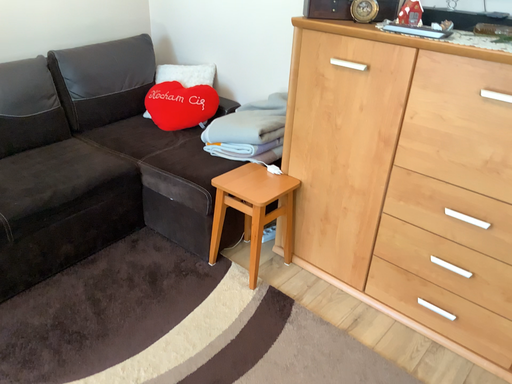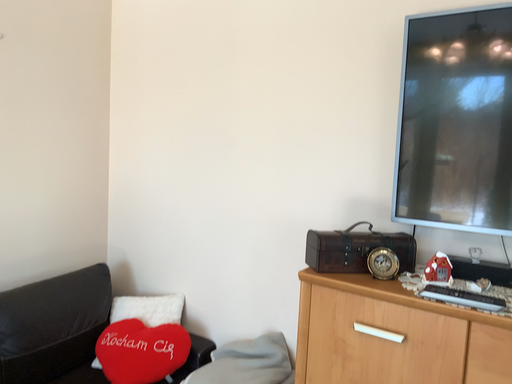
Question: Which way did the camera rotate in the video?

Choices:
 (A) rotated left
 (B) rotated right

Answer: (B)